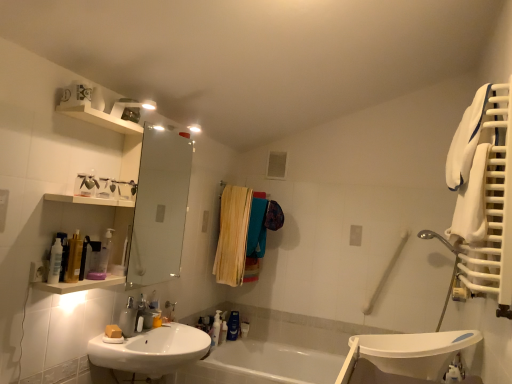
The width and height of the screenshot is (512, 384). I want to click on free spot to the right of matte yellow soap at sink left, so click(150, 335).